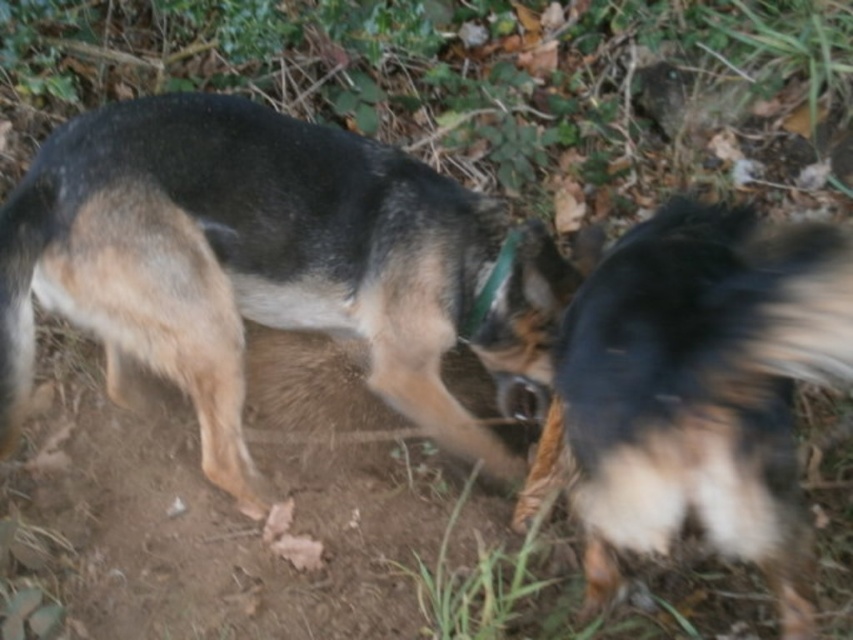
Which is more to the right, black fur dog at center or black fur tail at right?

From the viewer's perspective, black fur tail at right appears more on the right side.

Can you confirm if black fur dog at center is positioned above black fur tail at right?

Yes, black fur dog at center is above black fur tail at right.

Between point (396, 323) and point (753, 397), which one is positioned in front?

Point (753, 397) is in front.

The image size is (853, 640). In order to click on black fur dog at center in this screenshot , I will do `click(270, 266)`.